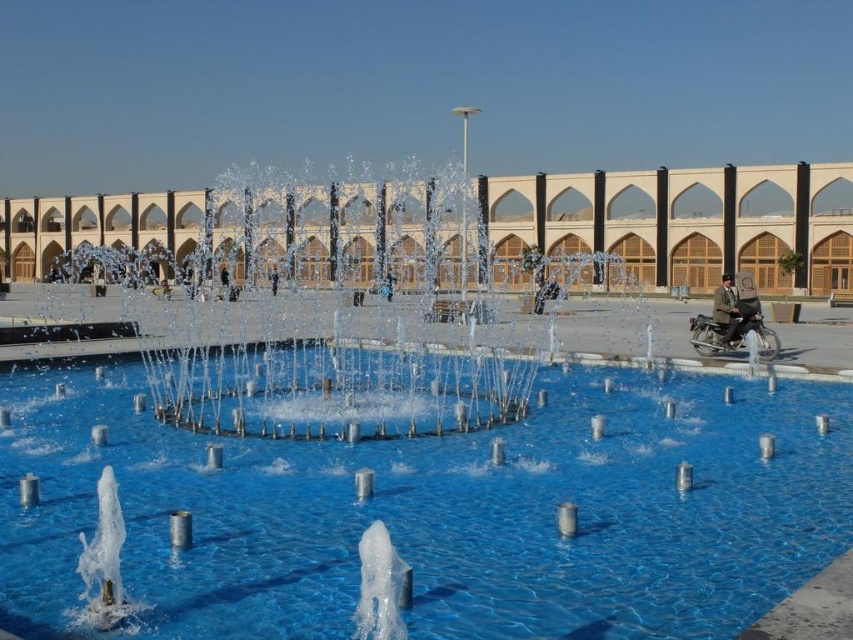
Is the position of transparent glass swimming pool at center more distant than that of shiny metallic motorcycle at right?

No, it is in front of shiny metallic motorcycle at right.

Between point (136, 374) and point (743, 278), which one is positioned behind?

Positioned behind is point (743, 278).

Locate an element on the screen. The height and width of the screenshot is (640, 853). transparent glass swimming pool at center is located at coordinates (438, 513).

Is point (537, 541) behind point (730, 332)?

That is False.

Who is more forward, (849,508) or (753,300)?

Point (849,508) is more forward.

This screenshot has width=853, height=640. What are the coordinates of `transparent glass swimming pool at center` in the screenshot? It's located at (438, 513).

Which is more to the left, shiny metallic motorcycle at right or dark brown leather jacket at right?

shiny metallic motorcycle at right

From the picture: Who is more forward, (701, 349) or (721, 291)?

Positioned in front is point (701, 349).

Which is in front, point (706, 348) or point (718, 324)?

Point (706, 348) is in front.

Find the location of `shiny metallic motorcycle at right`. shiny metallic motorcycle at right is located at coordinates (732, 321).